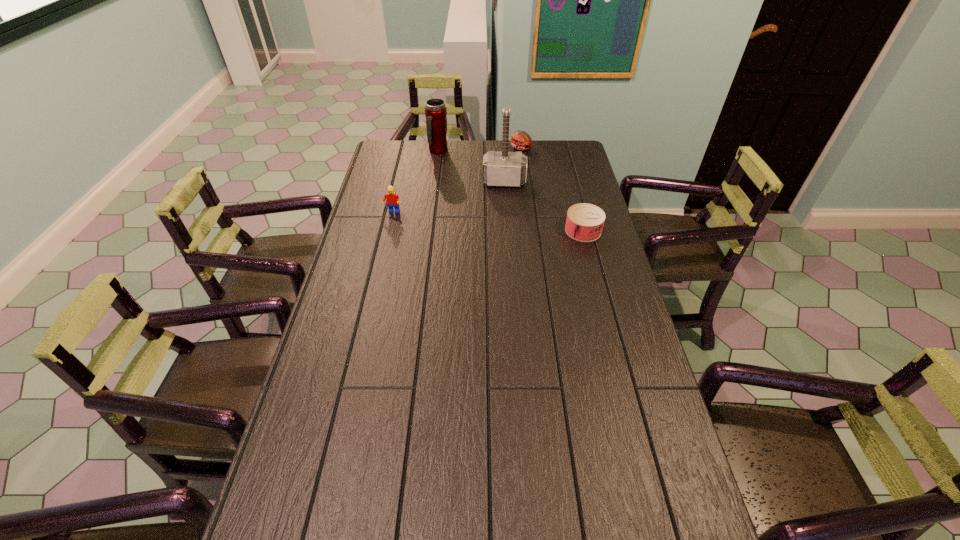
In order to click on free space located on the front of the nearest object in this screenshot , I will do `click(590, 259)`.

Locate an element on the screen. The image size is (960, 540). free location located on the front-facing side of the tomato is located at coordinates (513, 165).

Locate an element on the screen. The image size is (960, 540). free point located on the front-facing side of the tomato is located at coordinates (513, 165).

The image size is (960, 540). I want to click on free space located 0.230m on the front-facing side of the tomato, so click(x=504, y=180).

Image resolution: width=960 pixels, height=540 pixels. Find the location of `free region located 0.320m for striking with the head of the hammer`. free region located 0.320m for striking with the head of the hammer is located at coordinates (502, 240).

Identify the location of vacant area situated for striking with the head of the hammer. (502, 228).

Identify the location of vacant region located for striking with the head of the hammer. (502, 235).

I want to click on vacant space situated on the side with the handle of the second object from left to right, so click(x=456, y=188).

Find the location of `free space located 0.310m on the side with the handle of the second object from left to right`. free space located 0.310m on the side with the handle of the second object from left to right is located at coordinates (459, 195).

Where is `free region located on the side with the handle of the second object from left to right`? Image resolution: width=960 pixels, height=540 pixels. free region located on the side with the handle of the second object from left to right is located at coordinates (446, 170).